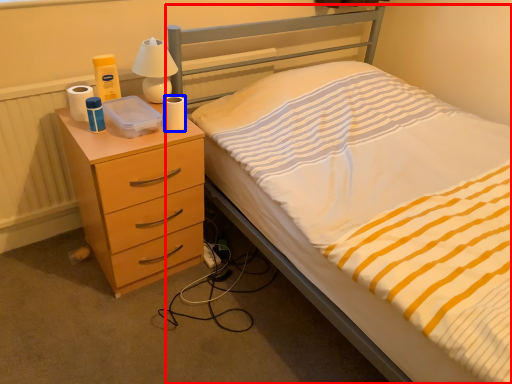
Question: Which object is further to the camera taking this photo, bed (highlighted by a red box) or toilet paper (highlighted by a blue box)?

Choices:
 (A) bed
 (B) toilet paper

Answer: (B)